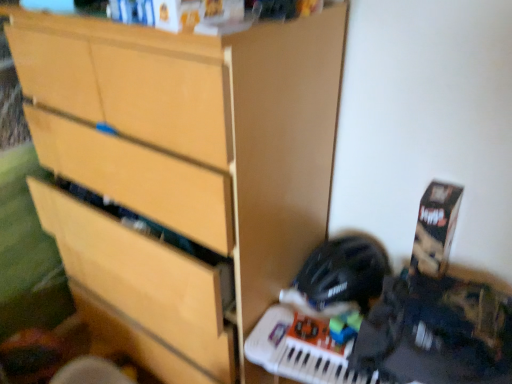
Question: Considering the relative positions of black matte helmet at lower right and matte wood chest of drawers at center in the image provided, is black matte helmet at lower right to the left of matte wood chest of drawers at center from the viewer's perspective?

Choices:
 (A) no
 (B) yes

Answer: (A)

Question: Is black matte helmet at lower right looking in the opposite direction of matte wood chest of drawers at center?

Choices:
 (A) yes
 (B) no

Answer: (B)

Question: Is matte wood chest of drawers at center surrounded by black matte helmet at lower right?

Choices:
 (A) yes
 (B) no

Answer: (B)

Question: Does black matte helmet at lower right have a larger size compared to matte wood chest of drawers at center?

Choices:
 (A) yes
 (B) no

Answer: (B)

Question: Does black matte helmet at lower right have a smaller size compared to matte wood chest of drawers at center?

Choices:
 (A) no
 (B) yes

Answer: (B)

Question: Is black matte helmet at lower right with matte wood chest of drawers at center?

Choices:
 (A) yes
 (B) no

Answer: (B)

Question: Is there a large distance between matte wood chest of drawers at center and black matte helmet at lower right?

Choices:
 (A) no
 (B) yes

Answer: (A)

Question: Can you confirm if matte wood chest of drawers at center is thinner than black matte helmet at lower right?

Choices:
 (A) yes
 (B) no

Answer: (B)

Question: Is matte wood chest of drawers at center smaller than black matte helmet at lower right?

Choices:
 (A) no
 (B) yes

Answer: (A)

Question: From a real-world perspective, is matte wood chest of drawers at center beneath black matte helmet at lower right?

Choices:
 (A) no
 (B) yes

Answer: (A)

Question: Considering the relative sizes of matte wood chest of drawers at center and black matte helmet at lower right in the image provided, is matte wood chest of drawers at center bigger than black matte helmet at lower right?

Choices:
 (A) no
 (B) yes

Answer: (B)

Question: Considering the relative positions of matte wood chest of drawers at center and black matte helmet at lower right in the image provided, is matte wood chest of drawers at center behind black matte helmet at lower right?

Choices:
 (A) no
 (B) yes

Answer: (A)

Question: From the image's perspective, is black matte helmet at lower right above or below matte wood chest of drawers at center?

Choices:
 (A) below
 (B) above

Answer: (A)